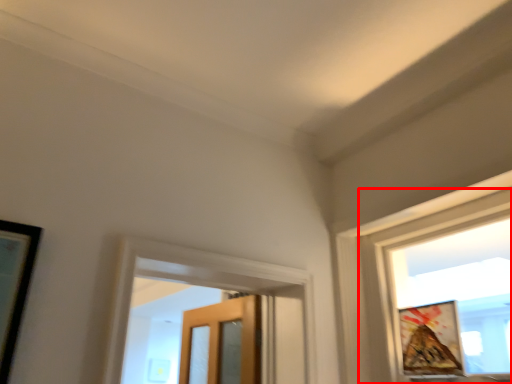
Question: In this image, where is window (annotated by the red box) located relative to picture frame?

Choices:
 (A) left
 (B) right

Answer: (B)